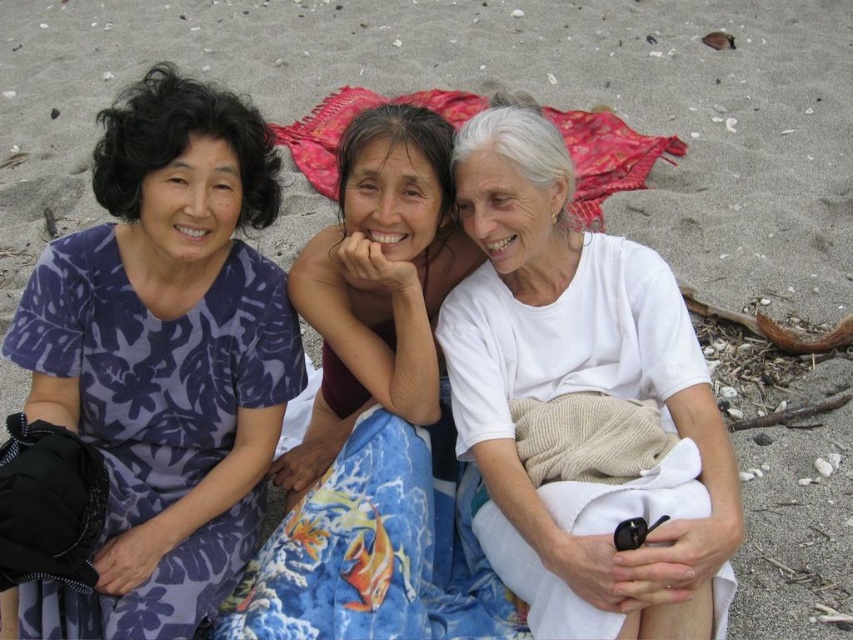
Is purple floral dress at left taller than red woven cloth at center?

Yes, purple floral dress at left is taller than red woven cloth at center.

Between purple floral dress at left and red woven cloth at center, which one has less height?

red woven cloth at center

Identify the location of purple floral dress at left. (164, 356).

Where is `purple floral dress at left`? purple floral dress at left is located at coordinates (164, 356).

In the scene shown: Who is taller, white cotton shirt at center or red woven cloth at center?

Standing taller between the two is white cotton shirt at center.

Does point (668, 588) lie in front of point (347, 104)?

Yes, it is.

Find the location of `white cotton shirt at center`. white cotton shirt at center is located at coordinates (581, 403).

Is matte floral dress at center above red woven cloth at center?

No.

Can you confirm if matte floral dress at center is positioned below red woven cloth at center?

Indeed, matte floral dress at center is positioned under red woven cloth at center.

Is point (410, 381) behind point (312, 131)?

No, (410, 381) is in front of (312, 131).

At what (x,y) coordinates should I click in order to perform the action: click on matte floral dress at center. Please return your answer as a coordinate pair (x, y). Image resolution: width=853 pixels, height=640 pixels. Looking at the image, I should click on (378, 282).